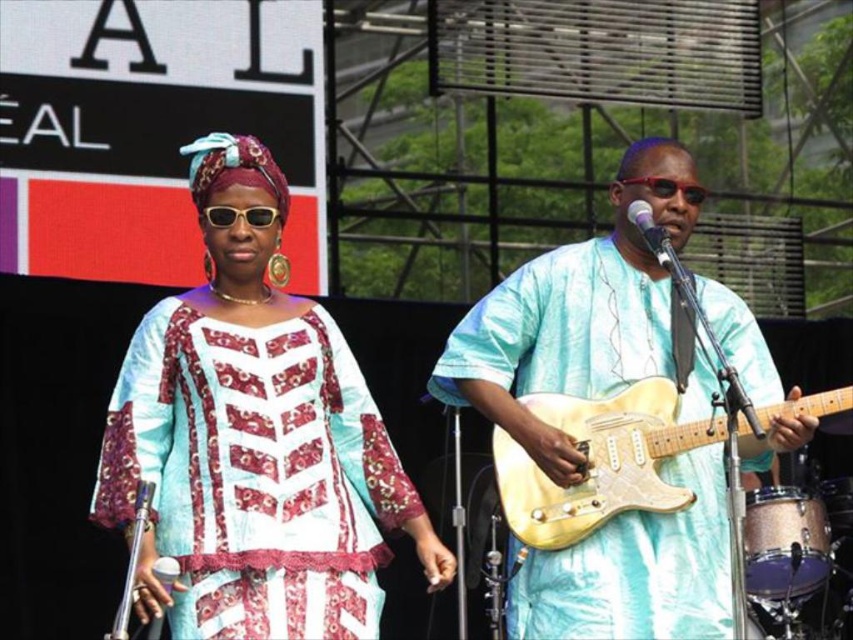
Between point (393, 518) and point (550, 428), which one is positioned in front?

Point (393, 518) is more forward.

Between matte teal and burgundy fabric dress at center and light blue fabric guitar at center, which one is positioned lower?

Positioned lower is light blue fabric guitar at center.

Which is behind, point (224, 268) or point (666, 531)?

The point (224, 268) is more distant.

I want to click on matte teal and burgundy fabric dress at center, so click(x=254, y=436).

Does light blue fabric guitar at center have a larger size compared to gold metallic drum at lower right?

Incorrect, light blue fabric guitar at center is not larger than gold metallic drum at lower right.

Can you confirm if light blue fabric guitar at center is taller than gold metallic drum at lower right?

In fact, light blue fabric guitar at center may be shorter than gold metallic drum at lower right.

Image resolution: width=853 pixels, height=640 pixels. What are the coordinates of `light blue fabric guitar at center` in the screenshot? It's located at (576, 314).

Locate an element on the screen. The height and width of the screenshot is (640, 853). light blue fabric guitar at center is located at coordinates (x=576, y=314).

Can you confirm if light blue fabric guitar at center is taller than light yellow wood guitar at center?

Answer: No.

Is light blue fabric guitar at center in front of light yellow wood guitar at center?

No, light blue fabric guitar at center is further to the viewer.

Between point (457, 374) and point (497, 474), which one is positioned in front?

Point (497, 474) is more forward.

At what (x,y) coordinates should I click in order to perform the action: click on light blue fabric guitar at center. Please return your answer as a coordinate pair (x, y). This screenshot has height=640, width=853. Looking at the image, I should click on (576, 314).